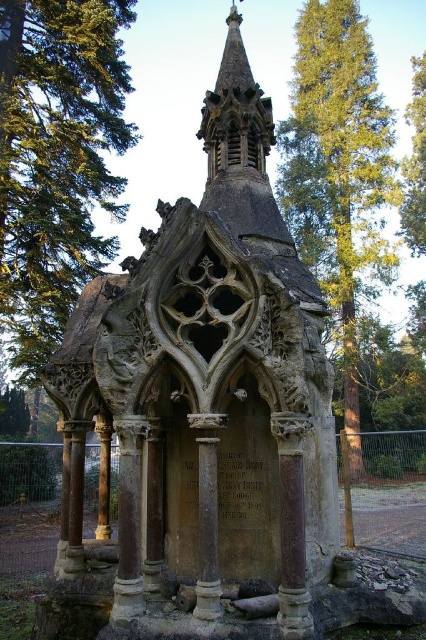
Question: Does stone gothic chapel at center have a smaller size compared to green leafy tree at left?

Choices:
 (A) no
 (B) yes

Answer: (B)

Question: Can you confirm if green leafy tree at upper center is positioned to the left of green leafy tree at upper right?

Choices:
 (A) no
 (B) yes

Answer: (B)

Question: Which point is farther to the camera?

Choices:
 (A) (420, 93)
 (B) (261, 589)

Answer: (A)

Question: Which point is closer to the camera?

Choices:
 (A) green leafy tree at left
 (B) green leafy tree at upper right

Answer: (A)

Question: Which of the following is the farthest from the observer?

Choices:
 (A) (416, 120)
 (B) (166, 252)
 (C) (135, 500)

Answer: (A)

Question: Does green leafy tree at left have a larger size compared to green leafy tree at upper center?

Choices:
 (A) yes
 (B) no

Answer: (B)